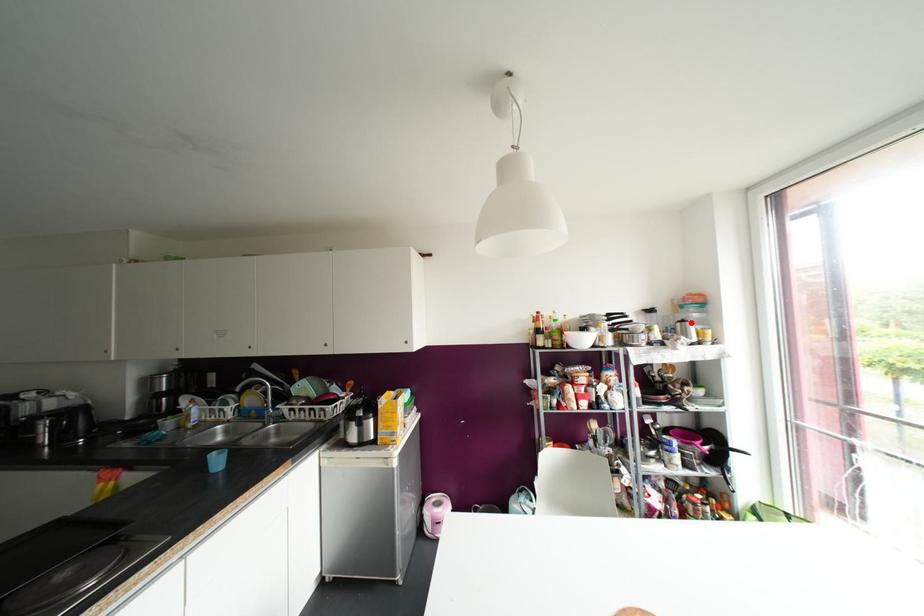
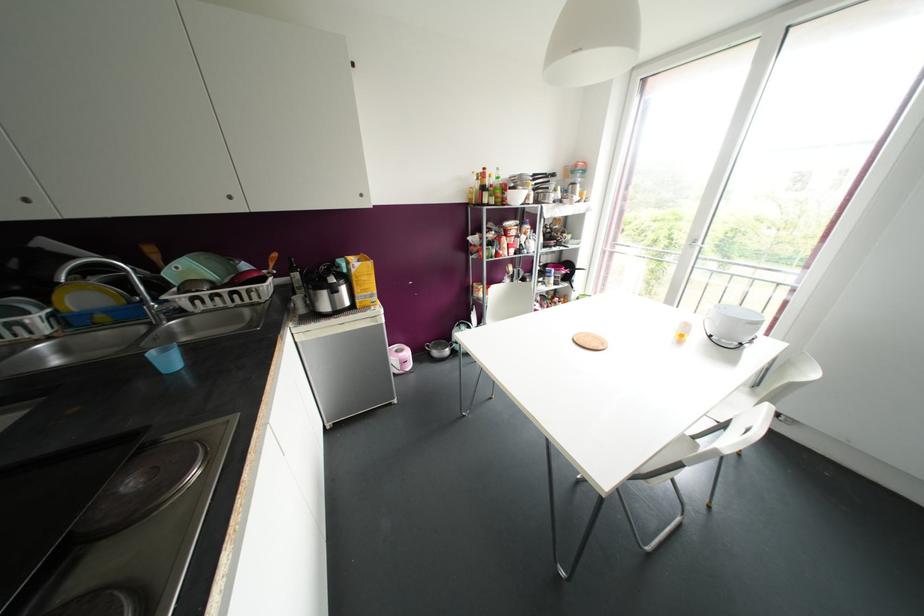
Where in the second image is the point corresponding to the highlighted location from the first image?

(578, 185)